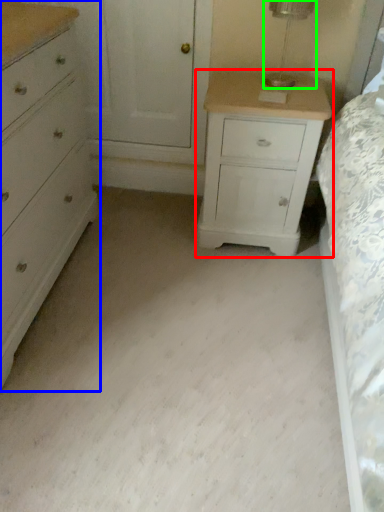
Question: Which is farther away from nightstand (highlighted by a red box)? chest of drawers (highlighted by a blue box) or table lamp (highlighted by a green box)?

Choices:
 (A) chest of drawers
 (B) table lamp

Answer: (A)